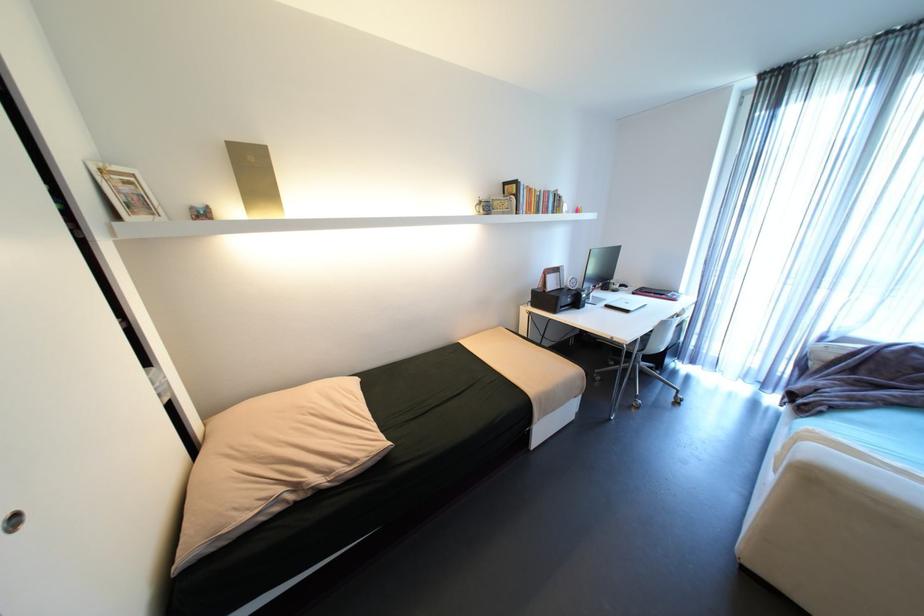
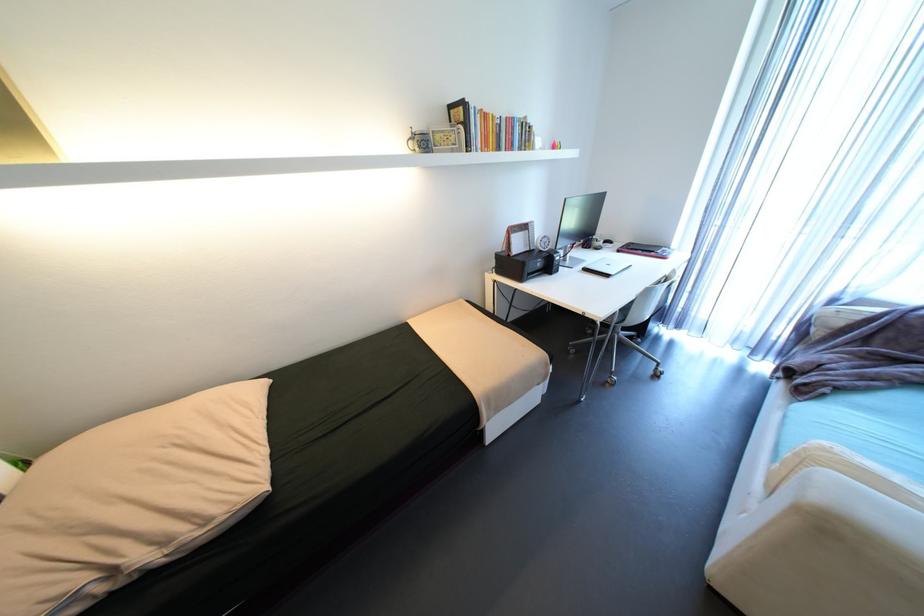
Based on the photo, which direction would the cameraman need to move to produce the second image?

The cameraman moved toward right, forward.